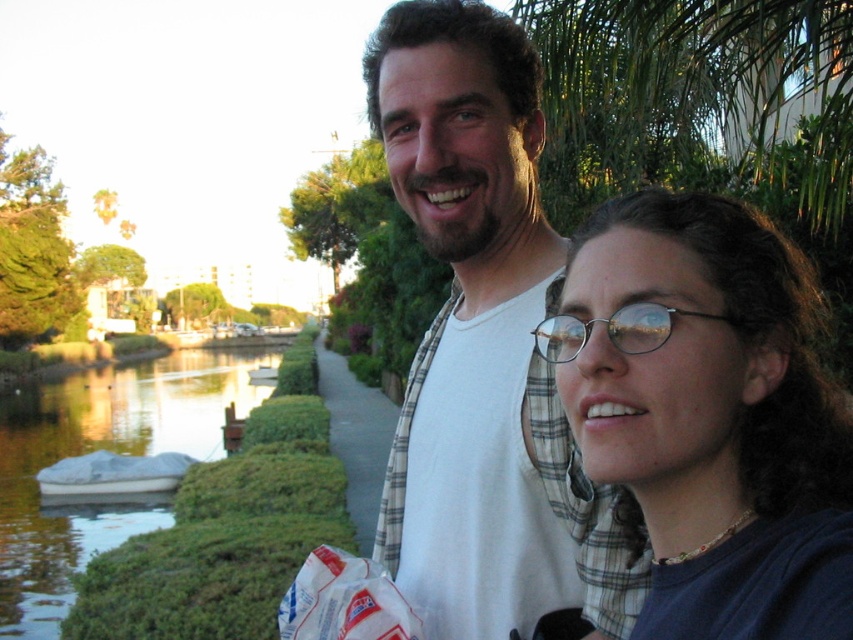
You are a photographer taking a picture of the clear plastic glasses at center and the green grassy river at lower left. Which object is located to the left of the other?

The green grassy river at lower left is positioned on the left side of clear plastic glasses at center.

You are a photographer trying to capture the reflection of the white cotton shirt at center in the green grassy river at lower left. Is the shirt positioned in a way that its reflection would be visible in the river?

The white cotton shirt at center is located above green grassy river at lower left, so its reflection would be visible in the river as long as the shirt is within the reflective surface of the water.